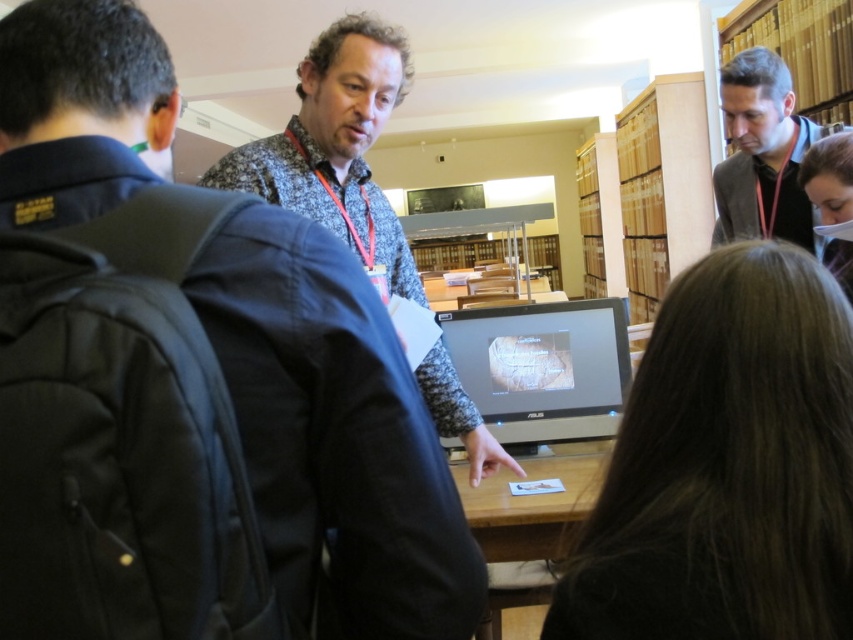
What do you see at coordinates (543, 369) in the screenshot? This screenshot has height=640, width=853. I see `satin black monitor at center` at bounding box center [543, 369].

Is satin black monitor at center shorter than wooden table at center?

No.

Which is in front, point (523, 305) or point (534, 499)?

Point (534, 499) is in front.

Where is `satin black monitor at center`? The width and height of the screenshot is (853, 640). satin black monitor at center is located at coordinates (543, 369).

Does speckled fabric shirt at center appear under satin black monitor at center?

Incorrect, speckled fabric shirt at center is not positioned below satin black monitor at center.

Can you confirm if speckled fabric shirt at center is positioned to the right of satin black monitor at center?

No, speckled fabric shirt at center is not to the right of satin black monitor at center.

Is point (320, 138) farther from viewer compared to point (619, 397)?

No, it is not.

Where is `speckled fabric shirt at center`? speckled fabric shirt at center is located at coordinates (337, 145).

Does speckled fabric shirt at center have a greater width compared to wooden table at center?

Yes, speckled fabric shirt at center is wider than wooden table at center.

Who is positioned more to the right, speckled fabric shirt at center or wooden table at center?

wooden table at center is more to the right.

Is point (358, 29) in front of point (587, 480)?

Yes.

In order to click on speckled fabric shirt at center in this screenshot , I will do `click(337, 145)`.